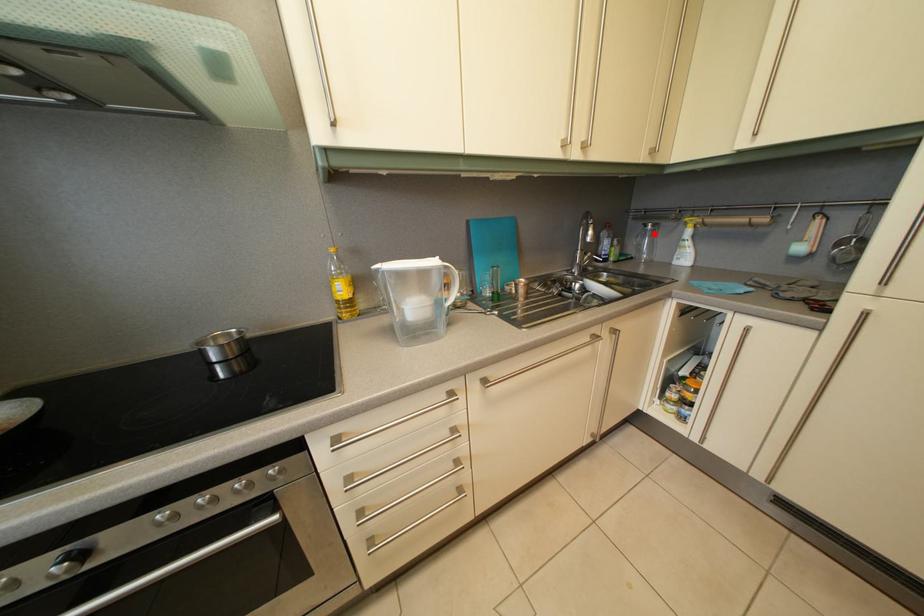
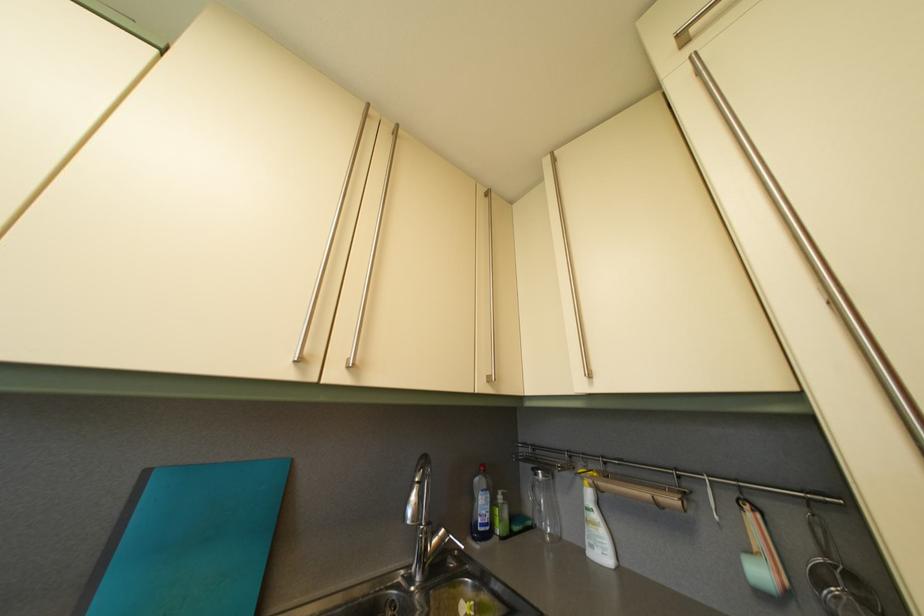
In the second image, find the point that corresponds to the highlighted location in the first image.

(544, 482)